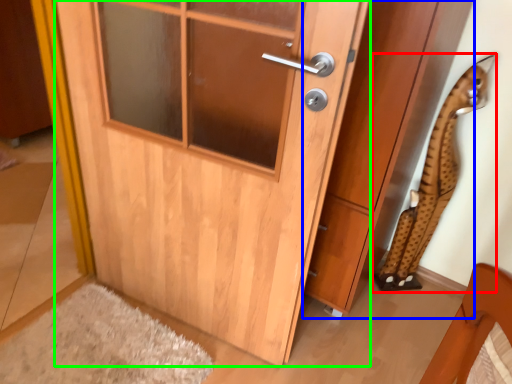
Question: Which object is positioned farthest from animal (highlighted by a red box)? Select from cabinetry (highlighted by a blue box) and door (highlighted by a green box).

Choices:
 (A) cabinetry
 (B) door

Answer: (B)